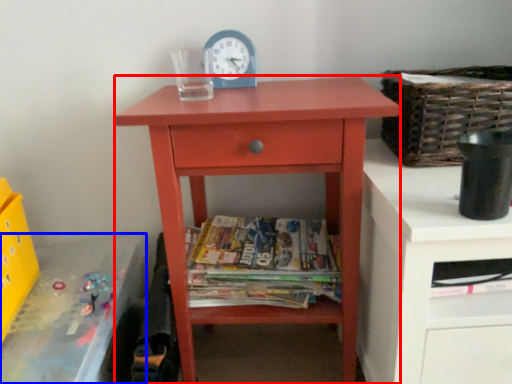
Question: Which object is further to the camera taking this photo, nightstand (highlighted by a red box) or changing table (highlighted by a blue box)?

Choices:
 (A) nightstand
 (B) changing table

Answer: (A)